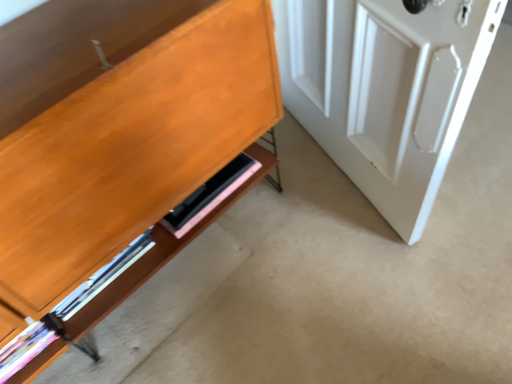
Question: Does pink matte shelf at lower center have a smaller size compared to white glossy door at right?

Choices:
 (A) no
 (B) yes

Answer: (B)

Question: Is there a large distance between pink matte shelf at lower center and white glossy door at right?

Choices:
 (A) no
 (B) yes

Answer: (A)

Question: Considering the relative positions of pink matte shelf at lower center and white glossy door at right in the image provided, is pink matte shelf at lower center behind white glossy door at right?

Choices:
 (A) yes
 (B) no

Answer: (A)

Question: Is pink matte shelf at lower center looking in the opposite direction of white glossy door at right?

Choices:
 (A) no
 (B) yes

Answer: (A)

Question: Is pink matte shelf at lower center shorter than white glossy door at right?

Choices:
 (A) yes
 (B) no

Answer: (A)

Question: From the image's perspective, is pink matte shelf at lower center over white glossy door at right?

Choices:
 (A) no
 (B) yes

Answer: (A)

Question: Is white glossy door at right surrounding pink matte shelf at lower center?

Choices:
 (A) yes
 (B) no

Answer: (B)

Question: From the image's perspective, would you say white glossy door at right is shown under pink matte shelf at lower center?

Choices:
 (A) yes
 (B) no

Answer: (B)

Question: Is white glossy door at right far away from pink matte shelf at lower center?

Choices:
 (A) no
 (B) yes

Answer: (A)

Question: Is white glossy door at right at the right side of pink matte shelf at lower center?

Choices:
 (A) no
 (B) yes

Answer: (B)

Question: Is white glossy door at right closer to camera compared to pink matte shelf at lower center?

Choices:
 (A) no
 (B) yes

Answer: (B)

Question: Can you confirm if white glossy door at right is shorter than pink matte shelf at lower center?

Choices:
 (A) no
 (B) yes

Answer: (A)

Question: Is white glossy door at right taller or shorter than pink matte shelf at lower center?

Choices:
 (A) tall
 (B) short

Answer: (A)